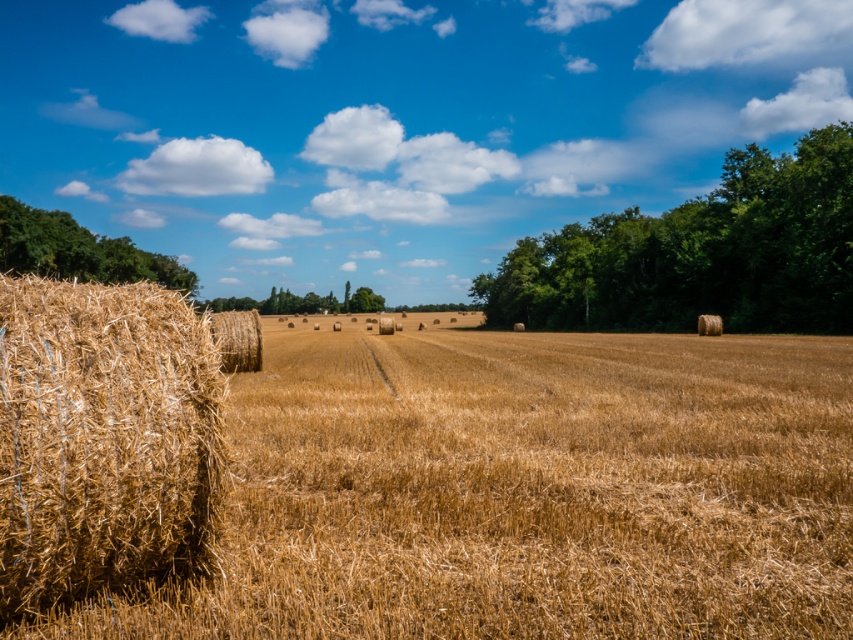
Question: Does green leafy tree at right come behind green leafy tree at center?

Choices:
 (A) yes
 (B) no

Answer: (B)

Question: Among these points, which one is nearest to the camera?

Choices:
 (A) (721, 506)
 (B) (506, 321)
 (C) (357, 294)
 (D) (28, 256)

Answer: (A)

Question: Which of the following is the farthest from the observer?

Choices:
 (A) (71, 636)
 (B) (231, 348)

Answer: (B)

Question: Does golden straw bale at center appear on the right side of green leafy tree at center?

Choices:
 (A) no
 (B) yes

Answer: (B)

Question: Can you confirm if green leafy tree at right is thinner than golden straw bale at center?

Choices:
 (A) yes
 (B) no

Answer: (B)

Question: Which point appears closest to the camera in this image?

Choices:
 (A) (335, 488)
 (B) (221, 342)
 (C) (35, 218)
 (D) (370, 298)

Answer: (A)